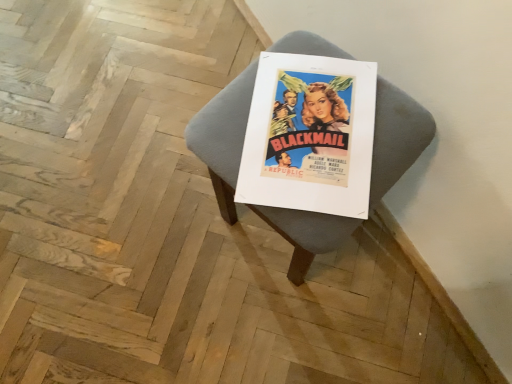
In the scene shown: What is the approximate width of matte gray cushion at center?

matte gray cushion at center is 13.47 inches in width.

This screenshot has width=512, height=384. Describe the element at coordinates (223, 137) in the screenshot. I see `matte gray cushion at center` at that location.

The height and width of the screenshot is (384, 512). In order to click on matte gray cushion at center in this screenshot , I will do `click(223, 137)`.

Measure the distance between point (355, 134) and camera.

Point (355, 134) and camera are 27.91 inches apart.

The height and width of the screenshot is (384, 512). Describe the element at coordinates (310, 135) in the screenshot. I see `matte paper poster at center` at that location.

The height and width of the screenshot is (384, 512). What are the coordinates of `matte paper poster at center` in the screenshot? It's located at (310, 135).

Find the location of `matte gray cushion at center`. matte gray cushion at center is located at coordinates (223, 137).

Which object is positioned more to the right, matte paper poster at center or matte gray cushion at center?

From the viewer's perspective, matte gray cushion at center appears more on the right side.

Is matte paper poster at center further to camera compared to matte gray cushion at center?

That is True.

Considering the points (340, 122) and (223, 171), which point is behind, point (340, 122) or point (223, 171)?

The point (340, 122) is more distant.

From the image's perspective, which is below, matte paper poster at center or matte gray cushion at center?

matte gray cushion at center is shown below in the image.

From a real-world perspective, is matte paper poster at center physically above matte gray cushion at center?

Yes, from a real-world perspective, matte paper poster at center is over matte gray cushion at center

Considering the sizes of objects matte paper poster at center and matte gray cushion at center in the image provided, who is thinner, matte paper poster at center or matte gray cushion at center?

Thinner between the two is matte paper poster at center.

Is matte paper poster at center shorter than matte gray cushion at center?

Yes.

Which of these two, matte paper poster at center or matte gray cushion at center, is smaller?

Smaller between the two is matte paper poster at center.

Is matte gray cushion at center a part of matte paper poster at center?

No.

Is matte paper poster at center positioned far away from matte gray cushion at center?

That's not correct — matte paper poster at center is a little close to matte gray cushion at center.

Is matte gray cushion at center at the back of matte paper poster at center?

Yes, matte paper poster at center's orientation is away from matte gray cushion at center.

You are a GUI agent. You are given a task and a screenshot of the screen. Output one action in this format:
    pyautogui.click(x=<x>, y=<y>)
    Task: Click on the poster positioned vertically above the matte gray cushion at center (from a real-world perspective)
    The width and height of the screenshot is (512, 384).
    Given the screenshot: What is the action you would take?
    pyautogui.click(x=310, y=135)

Would you say matte gray cushion at center is to the left or to the right of matte paper poster at center in the picture?

In the image, matte gray cushion at center appears on the right side of matte paper poster at center.

Does matte gray cushion at center lie in front of matte paper poster at center?

Yes, it is.

Considering the positions of points (221, 140) and (340, 83), is point (221, 140) closer to camera compared to point (340, 83)?

That is True.

From the image's perspective, is matte gray cushion at center beneath matte paper poster at center?

Correct, matte gray cushion at center appears lower than matte paper poster at center in the image.

From a real-world perspective, is matte gray cushion at center beneath matte paper poster at center?

Yes, from a real-world perspective, matte gray cushion at center is beneath matte paper poster at center.

In terms of width, does matte gray cushion at center look wider or thinner when compared to matte paper poster at center?

In the image, matte gray cushion at center appears to be wider than matte paper poster at center.

Does matte gray cushion at center have a lesser height compared to matte paper poster at center?

Incorrect, the height of matte gray cushion at center does not fall short of that of matte paper poster at center.

In the scene shown: Considering the sizes of objects matte gray cushion at center and matte paper poster at center in the image provided, who is smaller, matte gray cushion at center or matte paper poster at center?

With smaller size is matte paper poster at center.

Is matte paper poster at center a part of matte gray cushion at center?

Yes, matte gray cushion at center is surrounding matte paper poster at center.

Is matte gray cushion at center directly adjacent to matte paper poster at center?

Indeed, matte gray cushion at center and matte paper poster at center are beside each other and touching.

Could you tell me if matte gray cushion at center is turned towards matte paper poster at center?

No, matte gray cushion at center is not facing towards matte paper poster at center.

Can you tell me how much matte gray cushion at center and matte paper poster at center differ in facing direction?

matte gray cushion at center and matte paper poster at center are facing 34.1 degrees away from each other.

Where is `poster that is above the matte gray cushion at center (from a real-world perspective)`? The height and width of the screenshot is (384, 512). poster that is above the matte gray cushion at center (from a real-world perspective) is located at coordinates (310, 135).

This screenshot has height=384, width=512. What are the coordinates of `poster above the matte gray cushion at center (from the image's perspective)` in the screenshot? It's located at (310, 135).

You are a GUI agent. You are given a task and a screenshot of the screen. Output one action in this format:
    pyautogui.click(x=<x>, y=<y>)
    Task: Click on the furniture beneath the matte paper poster at center (from a real-world perspective)
    
    Given the screenshot: What is the action you would take?
    pyautogui.click(x=223, y=137)